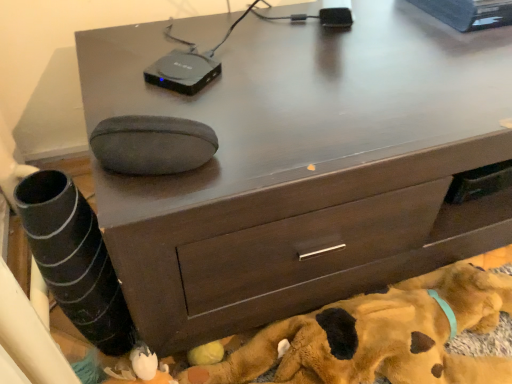
Where is `free space in front of black plastic device at upper center`? free space in front of black plastic device at upper center is located at coordinates (231, 135).